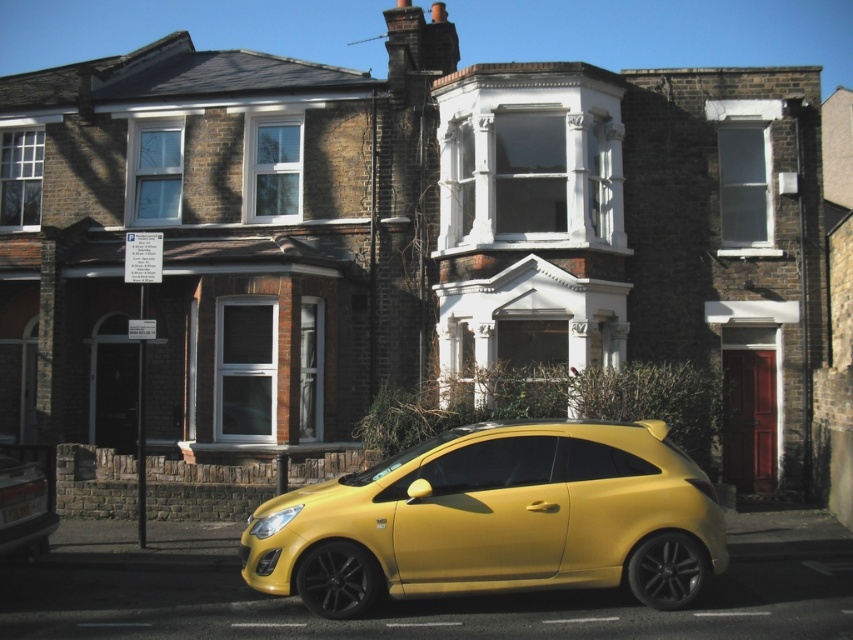
You are a delivery driver who needs to park your car in front of the two story brick building with a bay window and red door. The parking spot is marked at coordinate point 0.725, 0.046. Is the metallic yellow hatchback at lower left currently blocking your parking spot?

The metallic yellow hatchback at lower left is positioned exactly at point (38, 464), so it is blocking the parking spot.

You are a delivery person trying to park your van between the yellow matte car at lower center and the metallic yellow hatchback at lower left. Your van is 2 meters tall. Can you park your van there without hitting the roof?

The yellow matte car at lower center is much taller than the metallic yellow hatchback at lower left. Since the van is 2 meters tall, it depends on the height of the lower car. However, the description only states the relative height between the two cars, not their absolute heights. Without knowing the exact height of the shorter car, it is impossible to determine if the van can fit.